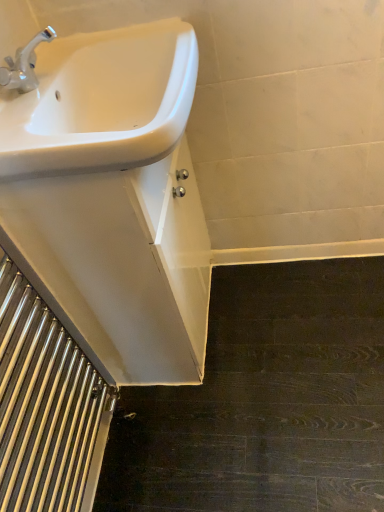
Question: Does white glossy sink at upper left have a smaller size compared to polished stainless steel stairwell at lower left?

Choices:
 (A) yes
 (B) no

Answer: (B)

Question: Does white glossy sink at upper left appear on the right side of polished stainless steel stairwell at lower left?

Choices:
 (A) yes
 (B) no

Answer: (A)

Question: Can you confirm if white glossy sink at upper left is bigger than polished stainless steel stairwell at lower left?

Choices:
 (A) yes
 (B) no

Answer: (A)

Question: Can you confirm if white glossy sink at upper left is taller than polished stainless steel stairwell at lower left?

Choices:
 (A) no
 (B) yes

Answer: (A)

Question: Is polished stainless steel stairwell at lower left located within white glossy sink at upper left?

Choices:
 (A) no
 (B) yes

Answer: (A)

Question: Is white glossy sink at upper left shorter than polished stainless steel stairwell at lower left?

Choices:
 (A) no
 (B) yes

Answer: (B)

Question: From a real-world perspective, is polished stainless steel stairwell at lower left positioned over white glossy sink at upper left based on gravity?

Choices:
 (A) no
 (B) yes

Answer: (A)

Question: From the image's perspective, is polished stainless steel stairwell at lower left on top of white glossy sink at upper left?

Choices:
 (A) yes
 (B) no

Answer: (B)

Question: Is white glossy sink at upper left surrounded by polished stainless steel stairwell at lower left?

Choices:
 (A) no
 (B) yes

Answer: (A)

Question: Can you confirm if polished stainless steel stairwell at lower left is wider than white glossy sink at upper left?

Choices:
 (A) yes
 (B) no

Answer: (B)

Question: Is polished stainless steel stairwell at lower left far from white glossy sink at upper left?

Choices:
 (A) yes
 (B) no

Answer: (B)

Question: Would you say polished stainless steel stairwell at lower left is outside white glossy sink at upper left?

Choices:
 (A) yes
 (B) no

Answer: (A)

Question: In the image, is polished stainless steel stairwell at lower left positioned in front of or behind white glossy sink at upper left?

Choices:
 (A) front
 (B) behind

Answer: (A)